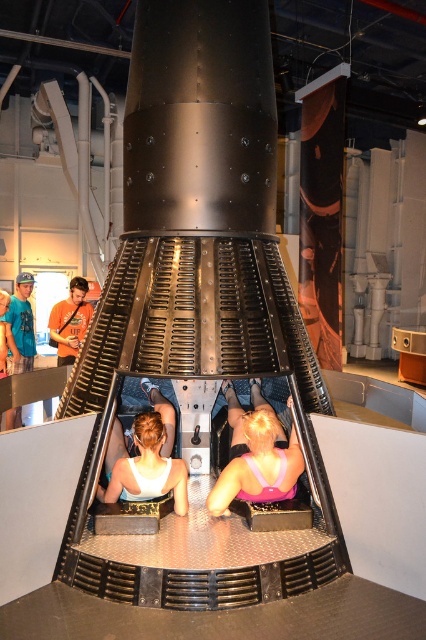
Question: Is pink fabric at center closer to the viewer compared to orange t-shirt at center?

Choices:
 (A) no
 (B) yes

Answer: (B)

Question: From the image, what is the correct spatial relationship of pink fabric at center in relation to orange t-shirt at center?

Choices:
 (A) above
 (B) below

Answer: (B)

Question: In this image, where is pink fabric at center located relative to white matte tank top at center?

Choices:
 (A) left
 (B) right

Answer: (B)

Question: Which of the following is the farthest from the observer?

Choices:
 (A) (140, 483)
 (B) (74, 314)
 (C) (229, 406)

Answer: (B)

Question: Which object is the closest to the white matte tank top at center?

Choices:
 (A) orange t-shirt at center
 (B) pink fabric at center

Answer: (B)

Question: Estimate the real-world distances between objects in this image. Which object is farther from the orange t-shirt at center?

Choices:
 (A) white matte tank top at center
 (B) pink fabric at center

Answer: (B)